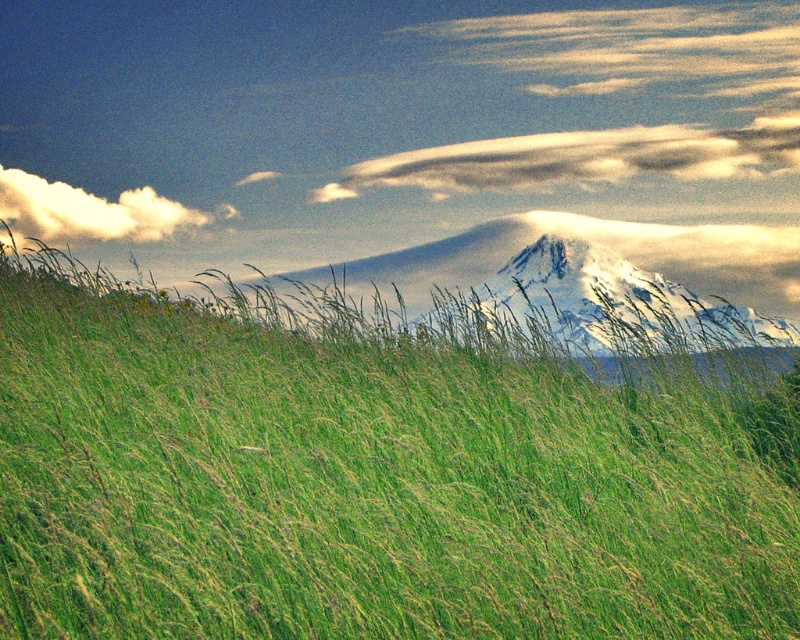
Question: Which object appears farthest from the camera in this image?

Choices:
 (A) white fluffy cloud at upper left
 (B) green grassy hillside at center

Answer: (A)

Question: Which point appears farthest from the camera in this image?

Choices:
 (A) (70, 627)
 (B) (226, 211)

Answer: (B)

Question: Among these points, which one is farthest from the camera?

Choices:
 (A) pos(782,508)
 (B) pos(34,230)

Answer: (B)

Question: Can you confirm if green grassy hillside at center is bigger than white fluffy cloud at upper left?

Choices:
 (A) yes
 (B) no

Answer: (B)

Question: In this image, where is green grassy hillside at center located relative to white fluffy cloud at upper left?

Choices:
 (A) right
 (B) left

Answer: (A)

Question: Is green grassy hillside at center positioned before white fluffy cloud at upper left?

Choices:
 (A) yes
 (B) no

Answer: (A)